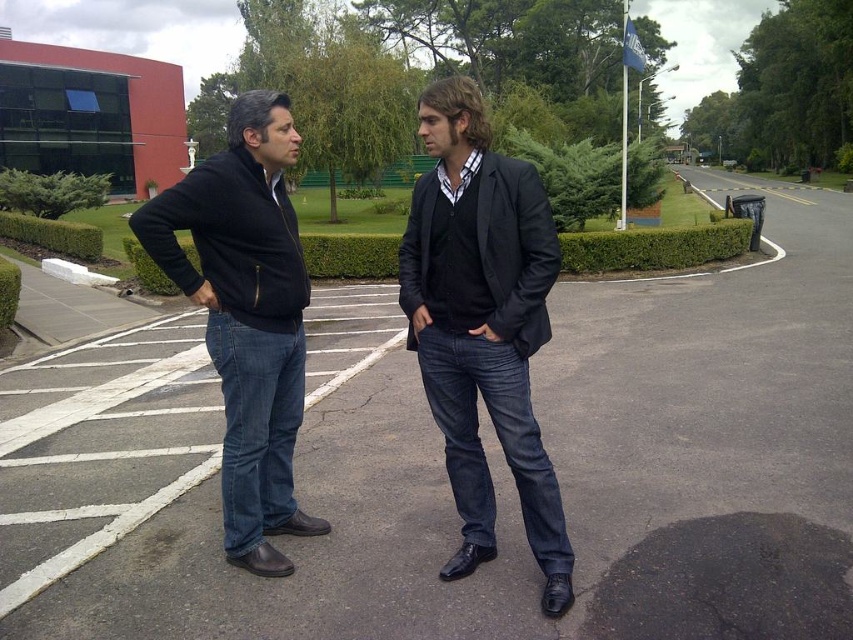
Question: Does dark asphalt parking lot at center appear on the left side of matte black blazer at center?

Choices:
 (A) yes
 (B) no

Answer: (B)

Question: Observing the image, what is the correct spatial positioning of dark asphalt parking lot at center in reference to matte black blazer at center?

Choices:
 (A) right
 (B) left

Answer: (A)

Question: Which object is farther from the camera taking this photo?

Choices:
 (A) dark asphalt parking lot at center
 (B) matte black blazer at center
 (C) dark blue jeans at center

Answer: (C)

Question: Based on their relative distances, which object is nearer to the matte black blazer at center?

Choices:
 (A) dark asphalt parking lot at center
 (B) dark blue jeans at center

Answer: (B)

Question: Which point is farther to the camera?

Choices:
 (A) (541, 451)
 (B) (599, 552)
 (C) (207, 305)

Answer: (B)

Question: Is dark asphalt parking lot at center thinner than matte black blazer at center?

Choices:
 (A) yes
 (B) no

Answer: (B)